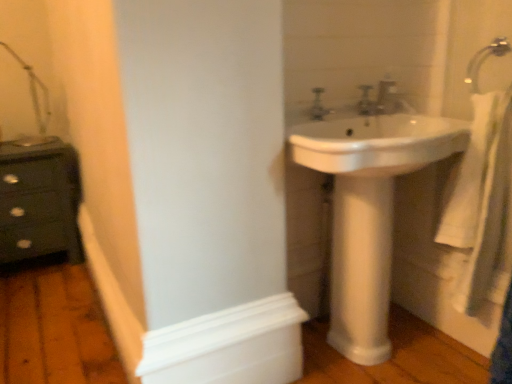
Question: From a real-world perspective, is silver metallic faucet at upper right positioned above or below white glossy sink at center?

Choices:
 (A) below
 (B) above

Answer: (B)

Question: Does point (323, 87) appear closer or farther from the camera than point (425, 119)?

Choices:
 (A) closer
 (B) farther

Answer: (A)

Question: Which of these objects is positioned farthest from the white cotton bath towel at right?

Choices:
 (A) silver metallic faucet at upper right
 (B) satin nickel faucet at upper right, placed as the second plumbing fixture when sorted from left to right
 (C) white glossy pedestal at center
 (D) matte silver faucet at upper center, the 1th plumbing fixture viewed from the left
 (E) white matte molding at lower left

Answer: (E)

Question: Which object is positioned closest to the white glossy sink at center?

Choices:
 (A) white cotton bath towel at right
 (B) silver metallic faucet at upper right
 (C) white glossy pedestal at center
 (D) satin nickel faucet at upper right, placed as the second plumbing fixture when sorted from left to right
 (E) white matte molding at lower left

Answer: (A)